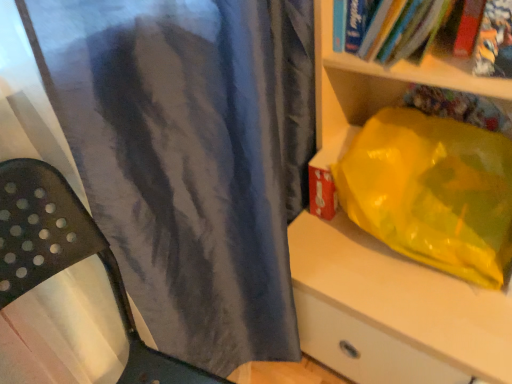
Question: From a real-world perspective, is matte plastic bag at right under hardcover book at upper right, the 2th book in the left-to-right sequence?

Choices:
 (A) no
 (B) yes

Answer: (B)

Question: Would you say hardcover book at upper right, the 2th book in the left-to-right sequence, is part of matte plastic bag at right's contents?

Choices:
 (A) no
 (B) yes

Answer: (B)

Question: Does matte plastic bag at right have a greater height compared to hardcover book at upper right, the 2th book in the left-to-right sequence?

Choices:
 (A) yes
 (B) no

Answer: (A)

Question: Would you say matte plastic bag at right is outside hardcover book at upper right, which is the first book in right-to-left order?

Choices:
 (A) no
 (B) yes

Answer: (B)

Question: From the image's perspective, does matte plastic bag at right appear lower than hardcover book at upper right, the 2th book in the left-to-right sequence?

Choices:
 (A) yes
 (B) no

Answer: (A)

Question: Does matte plastic bag at right come in front of hardcover book at upper right, which is the first book in right-to-left order?

Choices:
 (A) no
 (B) yes

Answer: (B)

Question: From the image's perspective, does hardcover book at upper right, positioned as the 2th book in right-to-left order, appear lower than hardcover book at upper right, which is the first book in right-to-left order?

Choices:
 (A) yes
 (B) no

Answer: (B)

Question: Does hardcover book at upper right, the first book viewed from the left, have a greater width compared to hardcover book at upper right, the 2th book in the left-to-right sequence?

Choices:
 (A) no
 (B) yes

Answer: (B)

Question: Does hardcover book at upper right, positioned as the 2th book in right-to-left order, appear on the right side of hardcover book at upper right, which is the first book in right-to-left order?

Choices:
 (A) no
 (B) yes

Answer: (A)

Question: Is hardcover book at upper right, positioned as the 2th book in right-to-left order, shorter than hardcover book at upper right, which is the first book in right-to-left order?

Choices:
 (A) yes
 (B) no

Answer: (A)

Question: Does hardcover book at upper right, positioned as the 2th book in right-to-left order, lie in front of hardcover book at upper right, which is the first book in right-to-left order?

Choices:
 (A) yes
 (B) no

Answer: (A)

Question: Considering the relative sizes of hardcover book at upper right, the first book viewed from the left, and hardcover book at upper right, the 2th book in the left-to-right sequence, in the image provided, is hardcover book at upper right, the first book viewed from the left, thinner than hardcover book at upper right, the 2th book in the left-to-right sequence,?

Choices:
 (A) yes
 (B) no

Answer: (B)

Question: Is hardcover book at upper right, the 2th book in the left-to-right sequence, beside matte plastic bag at right?

Choices:
 (A) no
 (B) yes

Answer: (A)